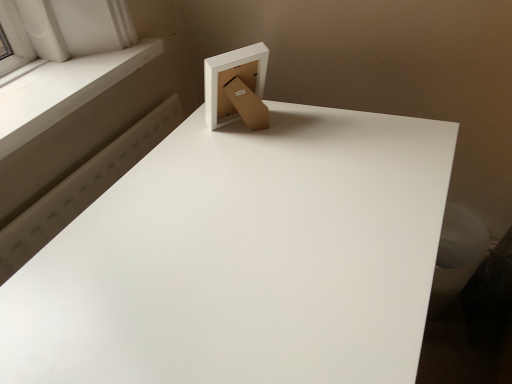
Identify the location of free point above white smooth window sill at upper left (from a real-world perspective). The image size is (512, 384). (61, 78).